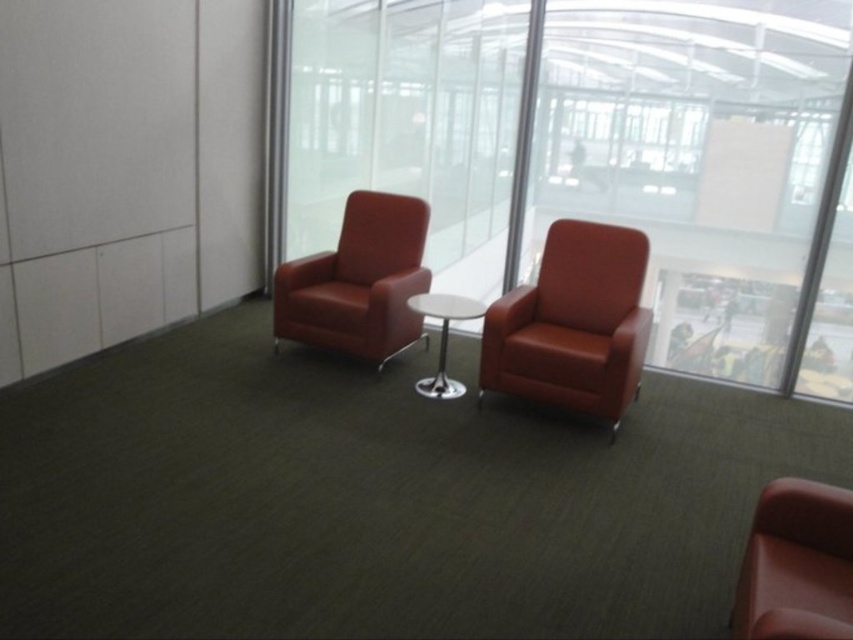
Question: Can you confirm if suede leather armchair at center is smaller than matte leather armchair at center?

Choices:
 (A) yes
 (B) no

Answer: (B)

Question: Estimate the real-world distances between objects in this image. Which object is closer to the suede leather armchair at center?

Choices:
 (A) transparent glass window at center
 (B) matte leather armchair at center
 (C) white glossy table at center
 (D) matte leather chair at lower right

Answer: (C)

Question: Based on their relative distances, which object is farther from the suede leather armchair at center?

Choices:
 (A) matte leather armchair at center
 (B) matte leather chair at lower right

Answer: (B)

Question: Does transparent glass window at center lie behind suede leather armchair at center?

Choices:
 (A) yes
 (B) no

Answer: (A)

Question: Can you confirm if transparent glass window at center is wider than matte leather armchair at center?

Choices:
 (A) no
 (B) yes

Answer: (B)

Question: Among these points, which one is nearest to the camera?

Choices:
 (A) (431, 305)
 (B) (837, 632)

Answer: (B)